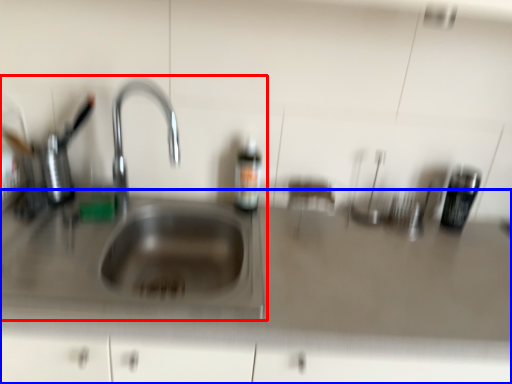
Question: Among these objects, which one is farthest to the camera, sink (highlighted by a red box) or counter top (highlighted by a blue box)?

Choices:
 (A) sink
 (B) counter top

Answer: (B)